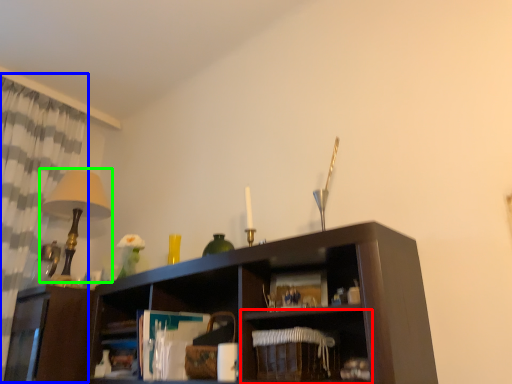
Question: Which object is positioned closest to shelf (highlighted by a red box)? Select from curtain (highlighted by a blue box) and table lamp (highlighted by a green box).

Choices:
 (A) curtain
 (B) table lamp

Answer: (B)